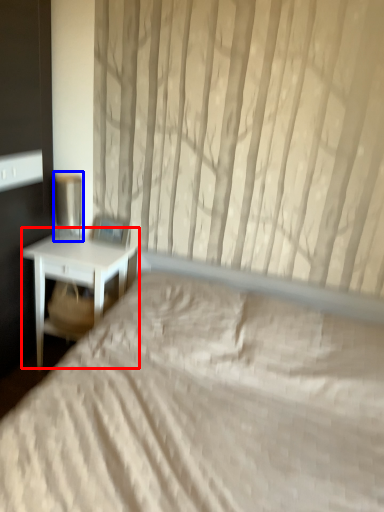
Question: Among these objects, which one is nearest to the camera, nightstand (highlighted by a red box) or table lamp (highlighted by a blue box)?

Choices:
 (A) nightstand
 (B) table lamp

Answer: (A)